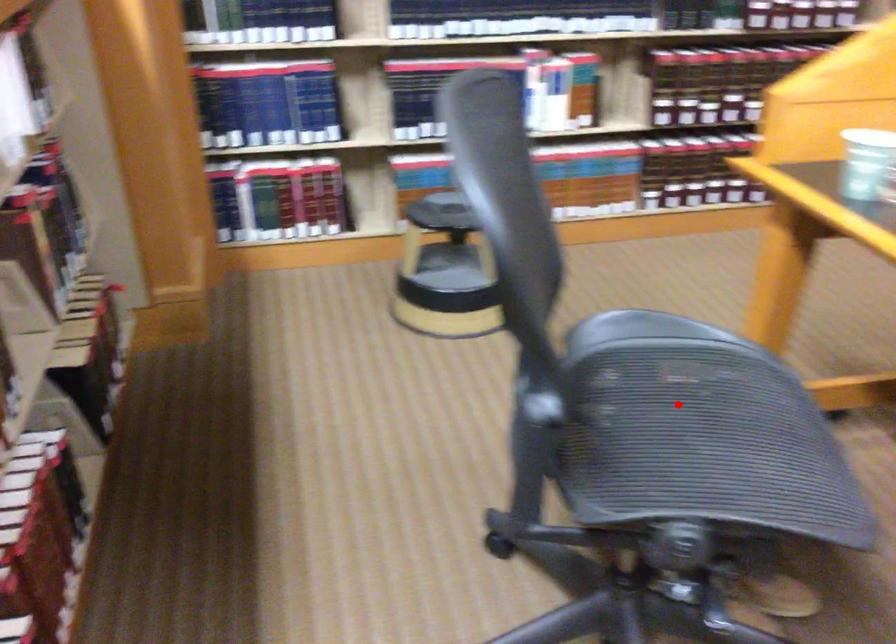
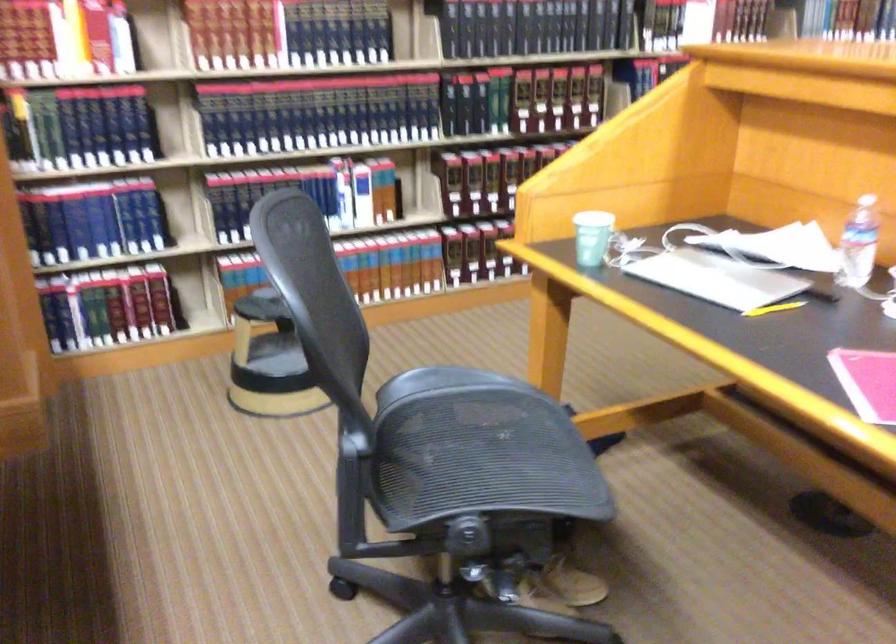
Find the pixel in the second image that matches the highlighted location in the first image.

(470, 442)